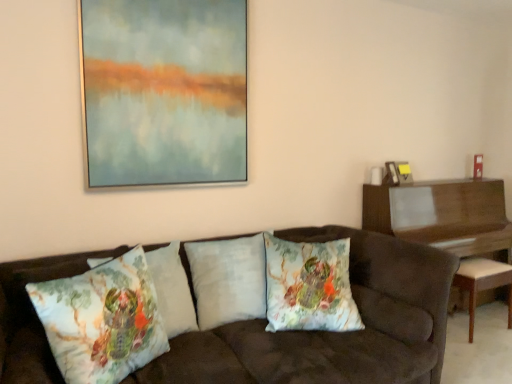
Question: From a real-world perspective, is metallic gold picture frame at upper right, positioned as the first picture frame in back-to-front order, positioned above or below wooden piano at right?

Choices:
 (A) above
 (B) below

Answer: (A)

Question: From the image's perspective, relative to wooden piano at right, is metallic gold picture frame at upper right, which is the third picture frame in front-to-back order, above or below?

Choices:
 (A) above
 (B) below

Answer: (A)

Question: Considering the real-world distances, which object is farthest from the suede couch at center?

Choices:
 (A) floral cotton cushion at center, acting as the fourth pillow starting from the left
 (B) floral-patterned fabric pillow at center, acting as the 3th pillow starting from the right
 (C) metallic gold picture frame at upper right, positioned as the first picture frame in back-to-front order
 (D) matte glass painting at upper center, which is the third picture frame from back to front
 (E) white fabric stool at right

Answer: (C)

Question: Which is nearer to the white fabric stool at right?

Choices:
 (A) floral cotton cushion at center, acting as the fourth pillow starting from the left
 (B) wooden piano at right
 (C) floral-patterned fabric pillow at center, which is the second pillow in left-to-right order
 (D) metallic gold picture frame at upper right, the 3th picture frame positioned from the left
 (E) floral-patterned fabric pillow at center, the first pillow viewed from the left

Answer: (B)